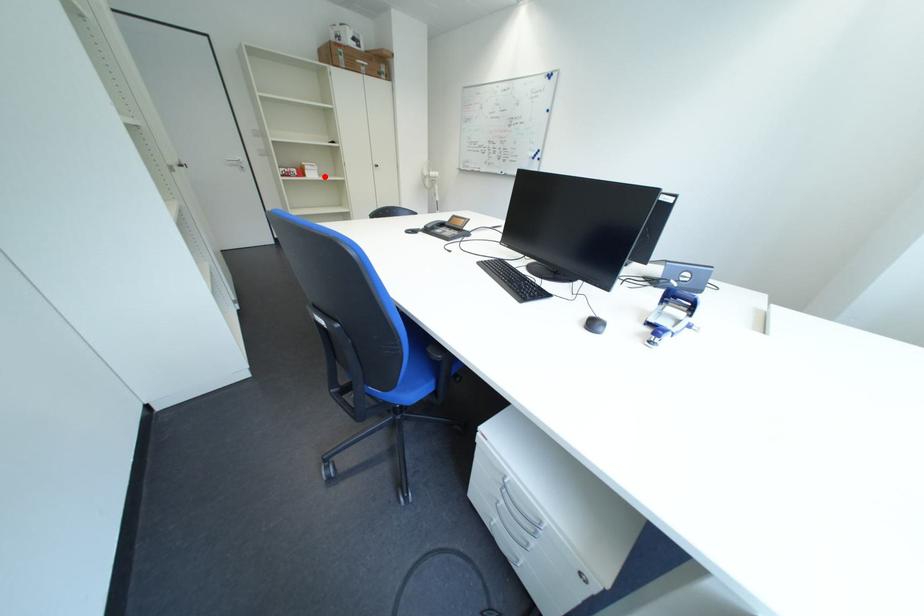
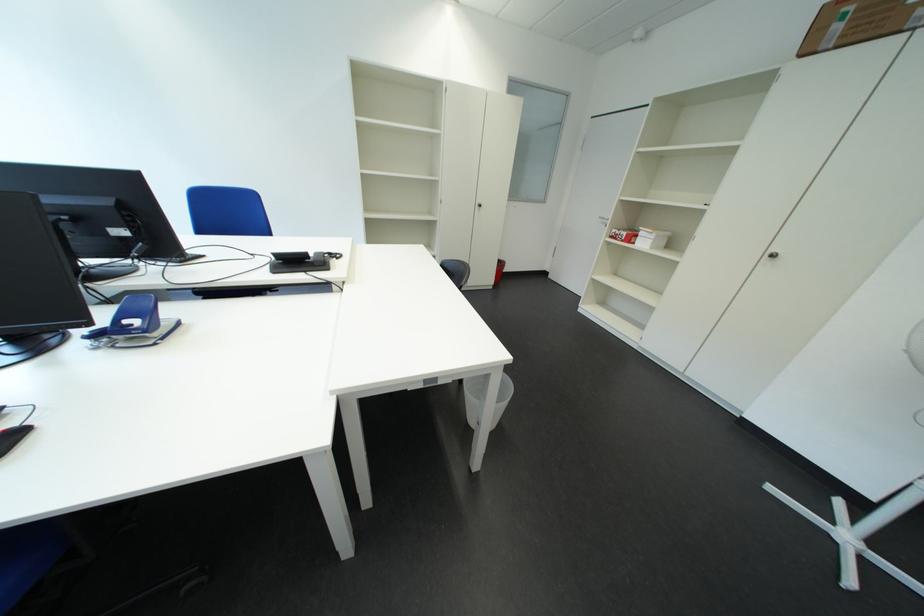
Question: I am providing you with two images of the same scene from different viewpoints. Image1 has a red point marked. In image2, the corresponding 3D location appears at what relative position? Reply with the corresponding letter.

Choices:
 (A) Closer
 (B) Farther

Answer: (B)